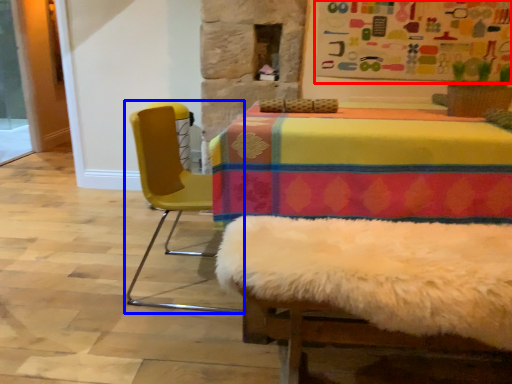
Question: Which object appears farthest to the camera in this image, bulletin board (highlighted by a red box) or chair (highlighted by a blue box)?

Choices:
 (A) bulletin board
 (B) chair

Answer: (A)